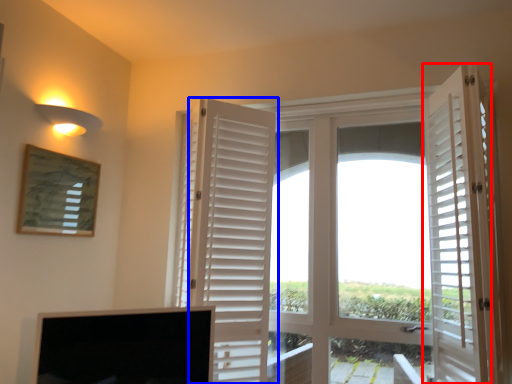
Question: Which object appears closest to the camera in this image, door (highlighted by a red box) or door (highlighted by a blue box)?

Choices:
 (A) door
 (B) door

Answer: (A)